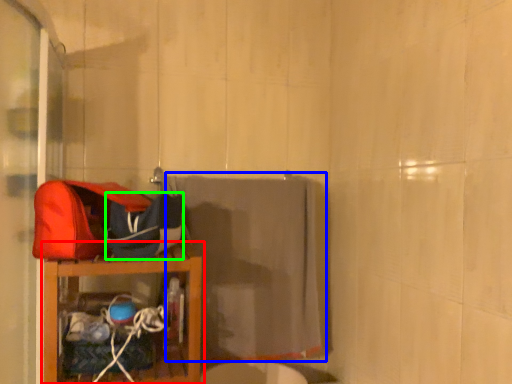
Question: Which is nearer to the furniture (highlighted by a red box)? bath towel (highlighted by a blue box) or kit (highlighted by a green box).

Choices:
 (A) bath towel
 (B) kit

Answer: (B)